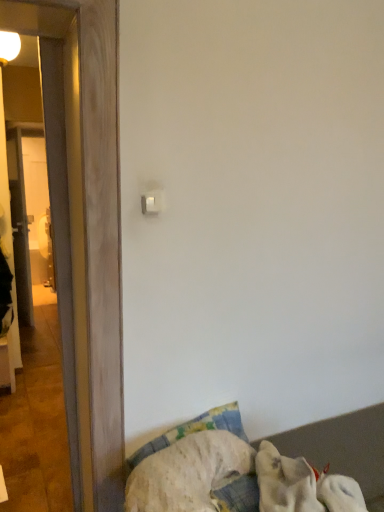
Question: Is white soft dog at lower right directly adjacent to wooden door at left?

Choices:
 (A) no
 (B) yes

Answer: (A)

Question: Considering the relative sizes of white soft dog at lower right and wooden door at left in the image provided, is white soft dog at lower right thinner than wooden door at left?

Choices:
 (A) yes
 (B) no

Answer: (B)

Question: Is white soft dog at lower right wider than wooden door at left?

Choices:
 (A) no
 (B) yes

Answer: (B)

Question: Does white soft dog at lower right appear on the right side of wooden door at left?

Choices:
 (A) no
 (B) yes

Answer: (B)

Question: Does white soft dog at lower right appear on the left side of wooden door at left?

Choices:
 (A) no
 (B) yes

Answer: (A)

Question: In terms of size, does white fabric at lower right appear bigger or smaller than white plastic light switch at upper center?

Choices:
 (A) big
 (B) small

Answer: (A)

Question: In terms of height, does white fabric at lower right look taller or shorter compared to white plastic light switch at upper center?

Choices:
 (A) short
 (B) tall

Answer: (B)

Question: Is white fabric at lower right spatially inside white plastic light switch at upper center, or outside of it?

Choices:
 (A) outside
 (B) inside

Answer: (A)

Question: Is white fabric at lower right wider or thinner than white plastic light switch at upper center?

Choices:
 (A) wide
 (B) thin

Answer: (A)

Question: In the image, is white soft dog at lower right on the left side or the right side of white fabric at lower right?

Choices:
 (A) right
 (B) left

Answer: (B)

Question: Do you think white soft dog at lower right is within white fabric at lower right, or outside of it?

Choices:
 (A) inside
 (B) outside

Answer: (B)

Question: In terms of size, does white soft dog at lower right appear bigger or smaller than white fabric at lower right?

Choices:
 (A) big
 (B) small

Answer: (B)

Question: From the image's perspective, relative to white fabric at lower right, is white soft dog at lower right above or below?

Choices:
 (A) above
 (B) below

Answer: (A)

Question: Is white fabric at lower right inside or outside of wooden door at left?

Choices:
 (A) inside
 (B) outside

Answer: (B)

Question: From a real-world perspective, relative to wooden door at left, is white fabric at lower right vertically above or below?

Choices:
 (A) above
 (B) below

Answer: (B)